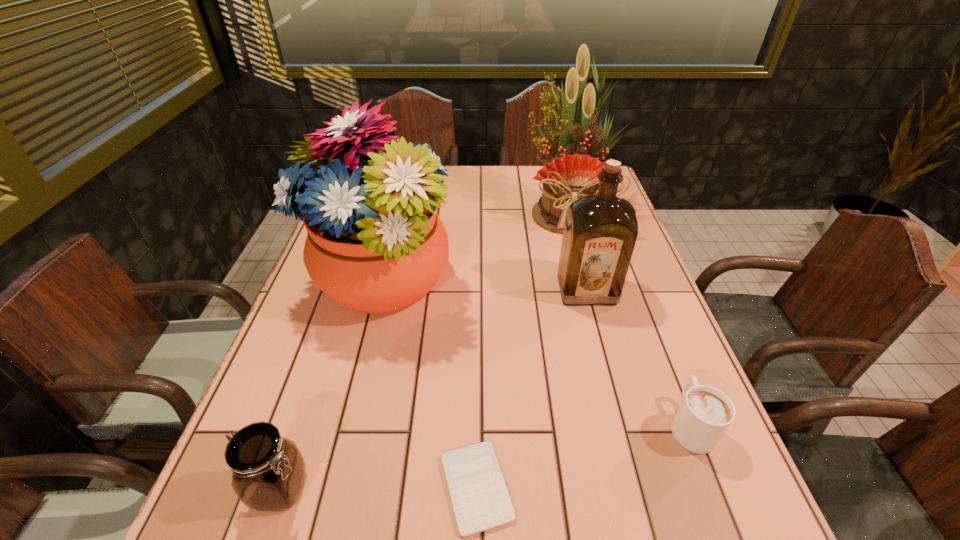
Where is `free space between the cappuccino and the calculator`? Image resolution: width=960 pixels, height=540 pixels. free space between the cappuccino and the calculator is located at coordinates coord(584,456).

The width and height of the screenshot is (960, 540). Find the location of `empty space between the calculator and the left flower arrangement`. empty space between the calculator and the left flower arrangement is located at coordinates (429, 384).

I want to click on vacant space that's between the right flower arrangement and the left flower arrangement, so click(x=474, y=246).

This screenshot has height=540, width=960. What are the coordinates of `free space between the third tallest object and the jar` in the screenshot? It's located at (434, 389).

Choose which object is the third nearest neighbor to the third shortest object. Please provide its 2D coordinates. Your answer should be formatted as a tuple, i.e. [(x, y)], where the tuple contains the x and y coordinates of a point satisfying the conditions above.

[(600, 231)]

What are the coordinates of `object identified as the fifth closest to the jar` in the screenshot? It's located at (572, 173).

Locate an element on the screen. vacant space that satisfies the following two spatial constraints: 1. on the label of the fourth shortest object; 2. on the lid of the fourth tallest object is located at coordinates (640, 489).